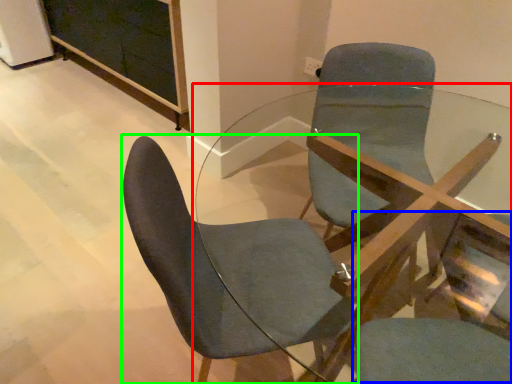
Question: Based on their relative distances, which object is nearer to table (highlighted by a red box)? Choose from swivel chair (highlighted by a blue box) and chair (highlighted by a green box).

Choices:
 (A) swivel chair
 (B) chair

Answer: (A)